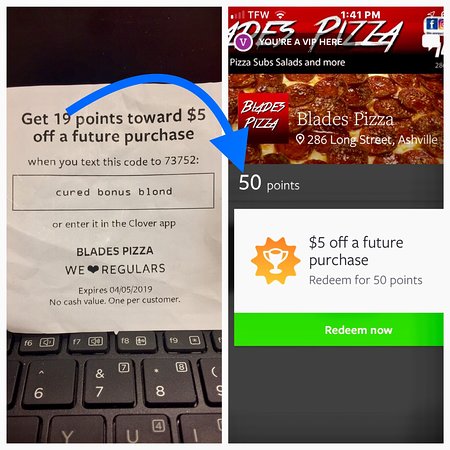
Identify the location of white piece of paper. (219, 262).